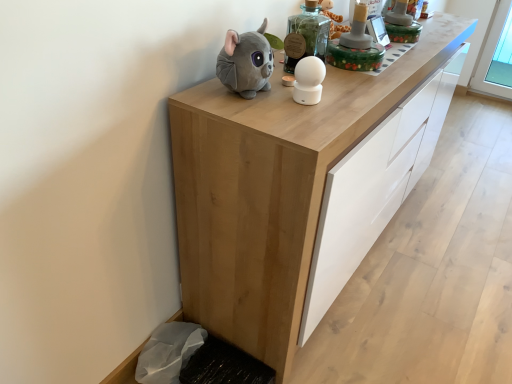
Question: Is soft gray plush toy at upper center, marked as the second toy in a right-to-left arrangement, positioned before white matte ball at center, which is counted as the 1th toy, starting from the right?

Choices:
 (A) yes
 (B) no

Answer: (A)

Question: From a real-world perspective, is soft gray plush toy at upper center, the 1th toy positioned from the left, positioned under white matte ball at center, which is the 2th toy in left-to-right order, based on gravity?

Choices:
 (A) no
 (B) yes

Answer: (A)

Question: Is soft gray plush toy at upper center, the 1th toy positioned from the left, smaller than white matte ball at center, which is counted as the 1th toy, starting from the right?

Choices:
 (A) no
 (B) yes

Answer: (A)

Question: Considering the relative sizes of soft gray plush toy at upper center, the 1th toy positioned from the left, and white matte ball at center, which is counted as the 1th toy, starting from the right, in the image provided, is soft gray plush toy at upper center, the 1th toy positioned from the left, taller than white matte ball at center, which is counted as the 1th toy, starting from the right,?

Choices:
 (A) yes
 (B) no

Answer: (A)

Question: Is soft gray plush toy at upper center, the 1th toy positioned from the left, not within white matte ball at center, which is counted as the 1th toy, starting from the right?

Choices:
 (A) yes
 (B) no

Answer: (A)

Question: Is soft gray plush toy at upper center, marked as the second toy in a right-to-left arrangement, beside white matte ball at center, which is counted as the 1th toy, starting from the right?

Choices:
 (A) yes
 (B) no

Answer: (B)

Question: Is natural wood cabinet at center to the right of white matte ball at center, which is the 2th toy in left-to-right order, from the viewer's perspective?

Choices:
 (A) no
 (B) yes

Answer: (B)

Question: Is natural wood cabinet at center to the left of white matte ball at center, which is the 2th toy in left-to-right order, from the viewer's perspective?

Choices:
 (A) yes
 (B) no

Answer: (B)

Question: Is natural wood cabinet at center looking in the opposite direction of white matte ball at center, which is the 2th toy in left-to-right order?

Choices:
 (A) yes
 (B) no

Answer: (B)

Question: Does natural wood cabinet at center have a lesser width compared to white matte ball at center, which is counted as the 1th toy, starting from the right?

Choices:
 (A) no
 (B) yes

Answer: (A)

Question: Can you confirm if natural wood cabinet at center is taller than white matte ball at center, which is counted as the 1th toy, starting from the right?

Choices:
 (A) yes
 (B) no

Answer: (A)

Question: Would you say natural wood cabinet at center is a long distance from white matte ball at center, which is the 2th toy in left-to-right order?

Choices:
 (A) no
 (B) yes

Answer: (A)

Question: Is soft gray plush toy at upper center, marked as the second toy in a right-to-left arrangement, positioned beyond the bounds of natural wood cabinet at center?

Choices:
 (A) no
 (B) yes

Answer: (B)